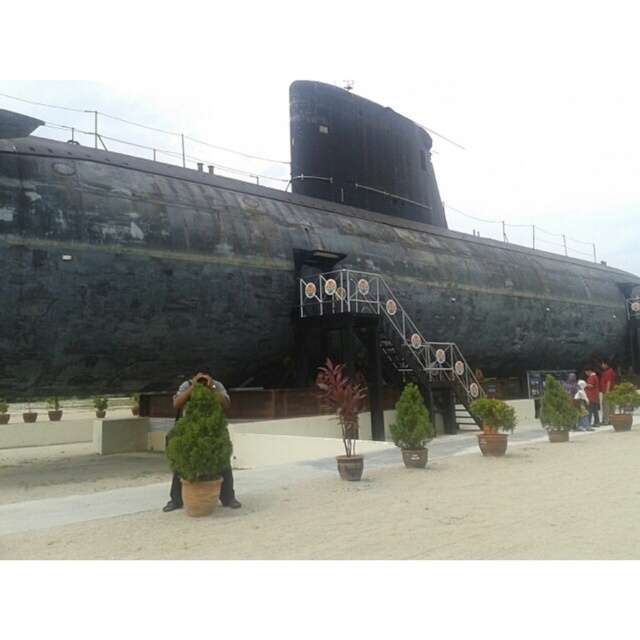
Does light brown fabric shirt at center lie behind red cotton shirt at center?

Yes, it is behind red cotton shirt at center.

Based on the photo, between light brown fabric shirt at center and red cotton shirt at center, which one has more height?

With more height is light brown fabric shirt at center.

Is point (596, 406) in front of point (605, 372)?

Yes, point (596, 406) is closer to viewer.

Find the location of a particular element. This screenshot has width=640, height=640. light brown fabric shirt at center is located at coordinates (592, 396).

Between point (173, 472) and point (608, 364), which one is positioned in front?

Point (173, 472) is in front.

What do you see at coordinates (192, 387) in the screenshot? I see `green leafy plant at center` at bounding box center [192, 387].

Locate an element on the screen. green leafy plant at center is located at coordinates (192, 387).

Is point (508, 332) positioned before point (596, 388)?

No, it is behind (596, 388).

Between point (211, 189) and point (593, 388), which one is positioned in front?

Point (211, 189) is more forward.

This screenshot has height=640, width=640. I want to click on rusty metal battleship at center, so click(260, 259).